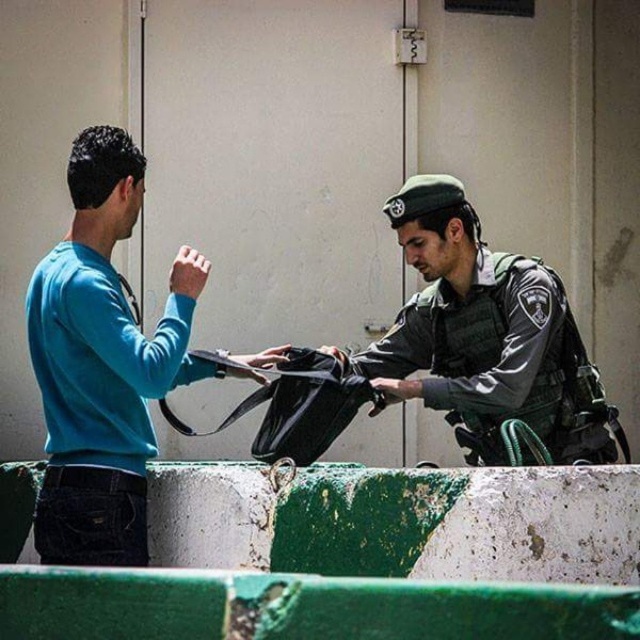
You are a visitor approaching the checkpoint and need to speak to the officer. Which individual should you approach first, the teal matte sweater at left or the green uniformed officer at center?

You should approach the teal matte sweater at left first because it is closer to you than the green uniformed officer at center, so you can reach them sooner.